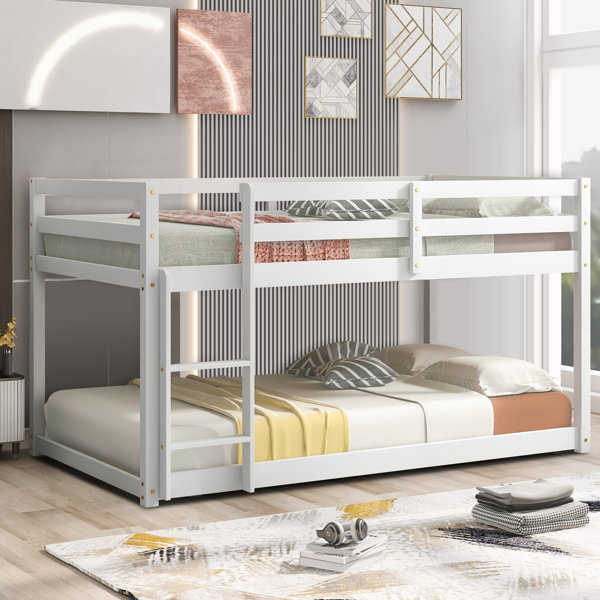
Identify the location of blanket. (502, 522).